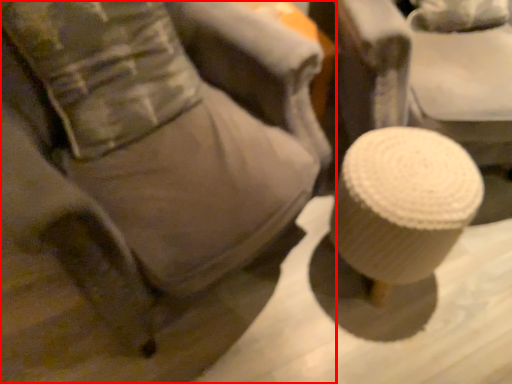
Question: From the image's perspective, what is the correct spatial positioning of furniture (annotated by the red box) in reference to pillow?

Choices:
 (A) below
 (B) above

Answer: (A)